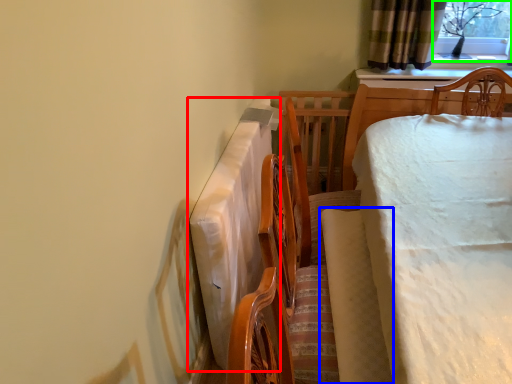
Question: Which object is positioned farthest from tablecloth (highlighted by a red box)? Select from blanket (highlighted by a blue box) and window screen (highlighted by a green box).

Choices:
 (A) blanket
 (B) window screen

Answer: (B)